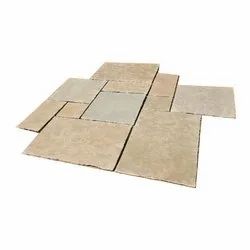
Identify the location of thinner width tiles. (54, 105), (67, 105), (120, 84), (168, 85), (161, 102), (159, 120).